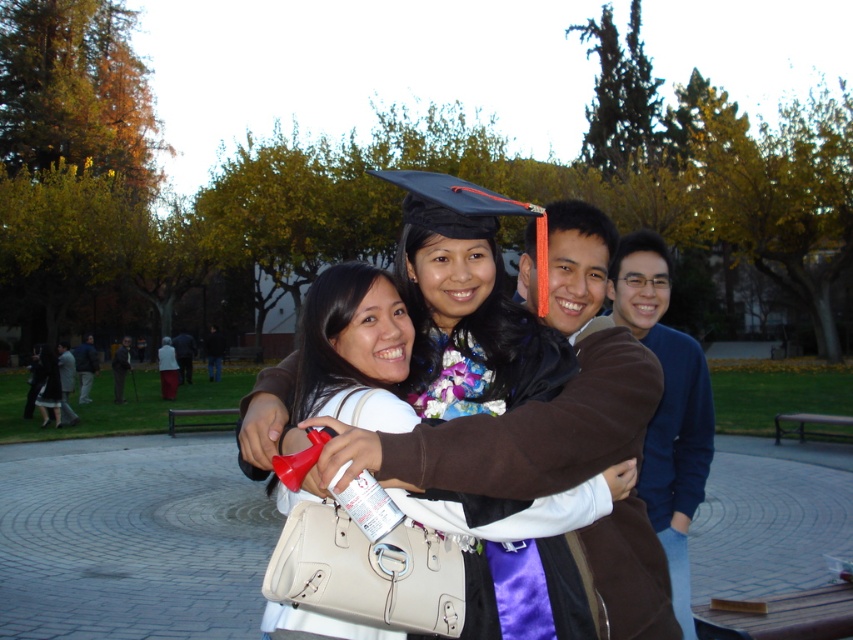
Question: Is matte black graduation cap at center positioned in front of blue cotton sweater at right?

Choices:
 (A) no
 (B) yes

Answer: (B)

Question: Estimate the real-world distances between objects in this image. Which object is farther from the light gray wool coat at lower left?

Choices:
 (A) dark blue jacket at center
 (B) matte black gown at center
 (C) matte black graduation cap at center

Answer: (B)

Question: Which point is farther to the camera?

Choices:
 (A) click(456, 348)
 (B) click(86, 376)
 (C) click(560, 364)

Answer: (B)

Question: Does blue cotton sweater at right have a larger size compared to dark blue jacket at center?

Choices:
 (A) no
 (B) yes

Answer: (A)

Question: Which point is closer to the camera taking this photo?

Choices:
 (A) (91, 352)
 (B) (503, 563)

Answer: (B)

Question: In this image, where is light gray wool coat at lower left located relative to dark blue jacket at center?

Choices:
 (A) above
 (B) below

Answer: (B)